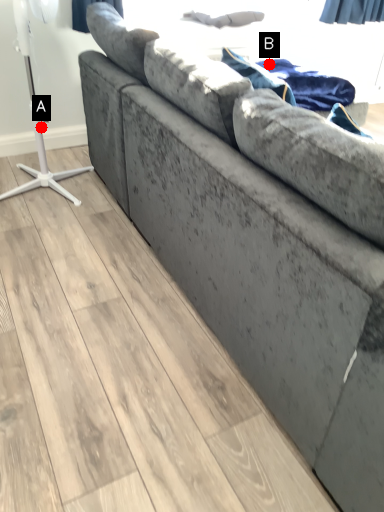
Question: Two points are circled on the image, labeled by A and B beside each circle. Which point is closer to the camera?

Choices:
 (A) A is closer
 (B) B is closer

Answer: (A)